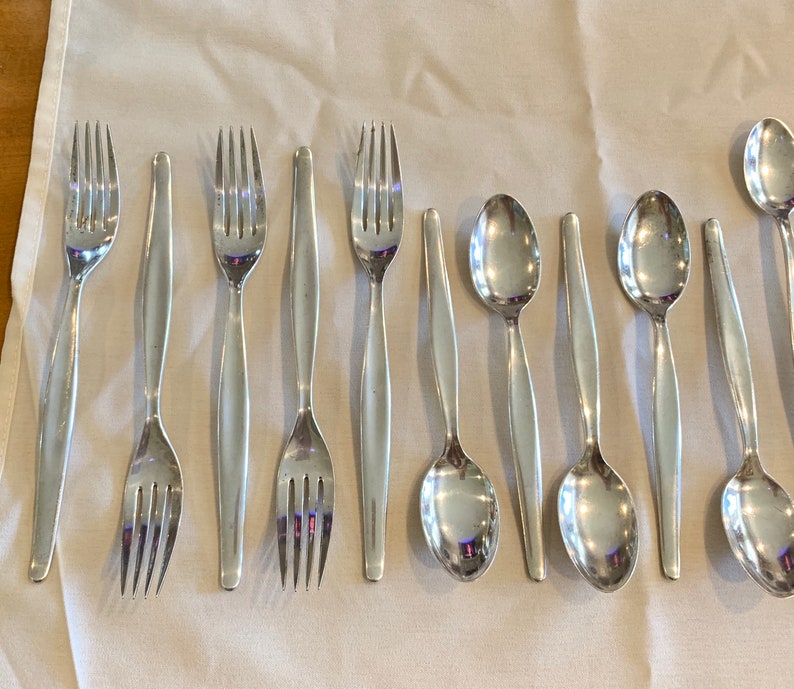
Locate an element on the screen. silverware with handle pointing down is located at coordinates click(67, 311), click(230, 331), click(376, 322), click(518, 360), click(665, 357), click(791, 240).